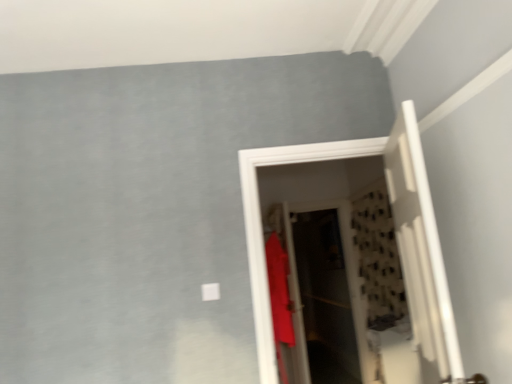
Question: Which direction should I rotate to face matte white door at center, the second door positioned from the front, — up or down?

Choices:
 (A) up
 (B) down

Answer: (B)

Question: From the image's perspective, is white wooden door at right, the 2th door viewed from the back, above matte red shirt at center?

Choices:
 (A) no
 (B) yes

Answer: (B)

Question: From the image's perspective, is white wooden door at right, positioned as the first door in front-to-back order, located beneath matte red shirt at center?

Choices:
 (A) no
 (B) yes

Answer: (A)

Question: Is white wooden door at right, positioned as the first door in front-to-back order, turned away from matte red shirt at center?

Choices:
 (A) yes
 (B) no

Answer: (B)

Question: From a real-world perspective, is white wooden door at right, the 2th door viewed from the back, located beneath matte red shirt at center?

Choices:
 (A) yes
 (B) no

Answer: (B)

Question: Is white wooden door at right, the 2th door viewed from the back, next to matte red shirt at center and touching it?

Choices:
 (A) no
 (B) yes

Answer: (A)

Question: Is white wooden door at right, the 2th door viewed from the back, bigger than matte red shirt at center?

Choices:
 (A) no
 (B) yes

Answer: (A)

Question: Can you confirm if translucent plastic screen door at center is wider than white wooden door at right, the 2th door viewed from the back?

Choices:
 (A) yes
 (B) no

Answer: (B)

Question: Is translucent plastic screen door at center taller than white wooden door at right, positioned as the first door in front-to-back order?

Choices:
 (A) yes
 (B) no

Answer: (A)

Question: Is translucent plastic screen door at center positioned with its back to white wooden door at right, the 2th door viewed from the back?

Choices:
 (A) no
 (B) yes

Answer: (A)

Question: Is the depth of translucent plastic screen door at center less than that of white wooden door at right, the 2th door viewed from the back?

Choices:
 (A) yes
 (B) no

Answer: (B)

Question: Is translucent plastic screen door at center further to camera compared to white wooden door at right, the 2th door viewed from the back?

Choices:
 (A) no
 (B) yes

Answer: (B)

Question: Considering the relative sizes of translucent plastic screen door at center and white wooden door at right, positioned as the first door in front-to-back order, in the image provided, is translucent plastic screen door at center smaller than white wooden door at right, positioned as the first door in front-to-back order,?

Choices:
 (A) no
 (B) yes

Answer: (B)

Question: Is translucent plastic screen door at center thinner than matte white door at center, marked as the first door in a back-to-front arrangement?

Choices:
 (A) no
 (B) yes

Answer: (B)